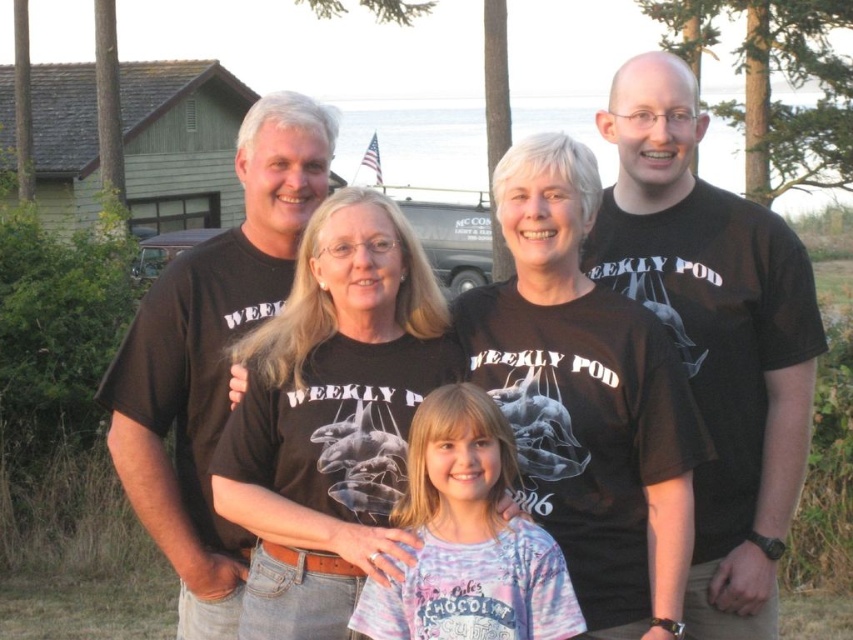
Does black matte t-shirt at center appear on the right side of tie-dye fabric shirt at center?

In fact, black matte t-shirt at center is to the left of tie-dye fabric shirt at center.

Is point (387, 509) behind point (370, 580)?

Yes, point (387, 509) is farther from viewer.

Where is `black matte t-shirt at center`? black matte t-shirt at center is located at coordinates (331, 417).

Does black cotton t-shirt at upper left have a larger size compared to tie-dye fabric shirt at center?

Yes.

Between black cotton t-shirt at upper left and tie-dye fabric shirt at center, which one is positioned higher?

black cotton t-shirt at upper left

This screenshot has height=640, width=853. In order to click on black cotton t-shirt at upper left in this screenshot , I will do `click(212, 355)`.

Based on the photo, which of these two, black matte t-shirt at center or black cotton t-shirt at upper left, stands shorter?

With less height is black matte t-shirt at center.

Is point (258, 598) less distant than point (142, 328)?

Yes, point (258, 598) is in front of point (142, 328).

Locate an element on the screen. This screenshot has width=853, height=640. black matte t-shirt at center is located at coordinates [x=331, y=417].

Locate an element on the screen. The image size is (853, 640). black matte t-shirt at center is located at coordinates (331, 417).